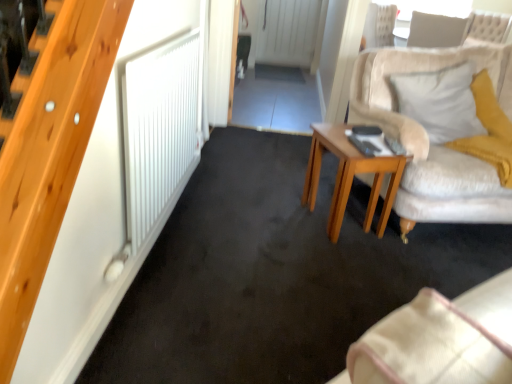
How much space does white fabric pillow at upper right, which is the 1th pillow in bottom-to-top order, occupy vertically?

white fabric pillow at upper right, which is the 1th pillow in bottom-to-top order, is 18.17 inches tall.

You are a GUI agent. You are given a task and a screenshot of the screen. Output one action in this format:
    pyautogui.click(x=<x>, y=<y>)
    Task: Click on the white fabric pillow at upper right, acting as the 2th pillow starting from the bottom
    The height and width of the screenshot is (384, 512).
    Given the screenshot: What is the action you would take?
    pyautogui.click(x=435, y=30)

Between white fabric pillow at upper right, the 2th pillow viewed from the top, and white fabric pillow at upper right, the first pillow when ordered from right to left, which one has larger size?

white fabric pillow at upper right, the first pillow when ordered from right to left.

Is white fabric pillow at upper right, placed as the 2th pillow when sorted from right to left, not close to white fabric pillow at upper right, which is the 1th pillow from back to front?

Yes, white fabric pillow at upper right, placed as the 2th pillow when sorted from right to left, and white fabric pillow at upper right, which is the 1th pillow from back to front, are quite far apart.

Can you confirm if white fabric pillow at upper right, which is the 1th pillow in bottom-to-top order, is positioned to the right of white fabric pillow at upper right, which is the 1th pillow from back to front?

Incorrect, white fabric pillow at upper right, which is the 1th pillow in bottom-to-top order, is not on the right side of white fabric pillow at upper right, which is the 1th pillow from back to front.

Which of these two, white fabric pillow at upper right, the 2th pillow viewed from the top, or white fabric pillow at upper right, marked as the 2th pillow in a left-to-right arrangement, is thinner?

white fabric pillow at upper right, the 2th pillow viewed from the top, is thinner.

Is white fabric pillow at upper right, acting as the 2th pillow starting from the bottom, far away from white fabric pillow at upper right, marked as the 2th pillow in a back-to-front arrangement?

Absolutely, white fabric pillow at upper right, acting as the 2th pillow starting from the bottom, is distant from white fabric pillow at upper right, marked as the 2th pillow in a back-to-front arrangement.

Where is `pillow below the white fabric pillow at upper right, acting as the 2th pillow starting from the bottom (from the image's perspective)`? The image size is (512, 384). pillow below the white fabric pillow at upper right, acting as the 2th pillow starting from the bottom (from the image's perspective) is located at coordinates (440, 102).

From the image's perspective, would you say white fabric pillow at upper right, the first pillow when ordered from right to left, is shown under white fabric pillow at upper right, the first pillow from the left?

No, from the image's perspective, white fabric pillow at upper right, the first pillow when ordered from right to left, is not below white fabric pillow at upper right, the first pillow from the left.

Considering the positions of points (439, 26) and (405, 103), is point (439, 26) farther from camera compared to point (405, 103)?

Yes, point (439, 26) is behind point (405, 103).

Considering the points (434, 45) and (388, 167), which point is in front, point (434, 45) or point (388, 167)?

The point (388, 167) is in front.

From the image's perspective, which one is positioned higher, white fabric pillow at upper right, marked as the 2th pillow in a left-to-right arrangement, or wooden side table at center?

From the image's view, white fabric pillow at upper right, marked as the 2th pillow in a left-to-right arrangement, is above.

Choose the correct answer: Is white fabric pillow at upper right, marked as the 1th pillow in a top-to-bottom arrangement, inside wooden side table at center or outside it?

white fabric pillow at upper right, marked as the 1th pillow in a top-to-bottom arrangement, is spatially situated outside wooden side table at center.

Can you tell me how much white fabric pillow at upper right, marked as the 2th pillow in a left-to-right arrangement, and wooden side table at center differ in facing direction?

125 degrees separate the facing orientations of white fabric pillow at upper right, marked as the 2th pillow in a left-to-right arrangement, and wooden side table at center.

Can white fabric pillow at upper right, the first pillow from the left, be found inside wooden side table at center?

Actually, white fabric pillow at upper right, the first pillow from the left, is outside wooden side table at center.

Is wooden side table at center in contact with white fabric pillow at upper right, which is the 1th pillow in bottom-to-top order?

No, wooden side table at center is not next to white fabric pillow at upper right, which is the 1th pillow in bottom-to-top order.

Measure the distance from wooden side table at center to white fabric pillow at upper right, marked as the 2th pillow in a back-to-front arrangement.

wooden side table at center and white fabric pillow at upper right, marked as the 2th pillow in a back-to-front arrangement, are 53.27 centimeters apart from each other.

From the image's perspective, who appears lower, wooden side table at center or white fabric pillow at upper right, marked as the 2th pillow in a back-to-front arrangement?

wooden side table at center, from the image's perspective.

Looking at this image, can you confirm if white fabric pillow at upper right, which is the 1th pillow in bottom-to-top order, is taller than wooden side table at center?

In fact, white fabric pillow at upper right, which is the 1th pillow in bottom-to-top order, may be shorter than wooden side table at center.

Looking at this image, is white fabric pillow at upper right, placed as the 2th pillow when sorted from right to left, bigger or smaller than wooden side table at center?

Considering their sizes, white fabric pillow at upper right, placed as the 2th pillow when sorted from right to left, takes up more space than wooden side table at center.

Is wooden side table at center at the back of white fabric pillow at upper right, the 2th pillow viewed from the top?

No, white fabric pillow at upper right, the 2th pillow viewed from the top, is not facing the opposite direction of wooden side table at center.

In the scene shown: From a real-world perspective, which is physically below, white fabric pillow at upper right, placed as the 2th pillow when sorted from right to left, or wooden side table at center?

wooden side table at center.

I want to click on the 2nd pillow directly above the wooden side table at center (from a real-world perspective), so click(x=435, y=30).

From a real-world perspective, between wooden side table at center and white fabric pillow at upper right, marked as the 2th pillow in a left-to-right arrangement, who is vertically lower?

wooden side table at center is physically lower.

Considering the relative positions of wooden side table at center and white fabric pillow at upper right, which is the 1th pillow from back to front, in the image provided, is wooden side table at center behind white fabric pillow at upper right, which is the 1th pillow from back to front,?

No, wooden side table at center is in front of white fabric pillow at upper right, which is the 1th pillow from back to front.

Identify the location of pillow in front of the white fabric pillow at upper right, marked as the 1th pillow in a top-to-bottom arrangement. The height and width of the screenshot is (384, 512). (440, 102).

The height and width of the screenshot is (384, 512). Identify the location of pillow behind the white fabric pillow at upper right, which is the 1th pillow in bottom-to-top order. (435, 30).

Looking at the image, which one is located further to wooden side table at center, white fabric pillow at upper right, marked as the 2th pillow in a left-to-right arrangement, or white fabric pillow at upper right, marked as the 2th pillow in a back-to-front arrangement?

Based on the image, white fabric pillow at upper right, marked as the 2th pillow in a left-to-right arrangement, appears to be further to wooden side table at center.

Estimate the real-world distances between objects in this image. Which object is closer to white fabric pillow at upper right, the first pillow when ordered from right to left, wooden side table at center or white fabric pillow at upper right, the 2th pillow viewed from the top?

white fabric pillow at upper right, the 2th pillow viewed from the top, is positioned closer to the anchor white fabric pillow at upper right, the first pillow when ordered from right to left.

Considering their positions, is white fabric pillow at upper right, the first pillow from the left, positioned closer to white fabric pillow at upper right, marked as the 2th pillow in a left-to-right arrangement, than wooden side table at center?

Based on the image, white fabric pillow at upper right, the first pillow from the left, appears to be nearer to white fabric pillow at upper right, marked as the 2th pillow in a left-to-right arrangement.

Considering their positions, is white fabric pillow at upper right, marked as the 1th pillow in a top-to-bottom arrangement, positioned further to white fabric pillow at upper right, marked as the 2th pillow in a back-to-front arrangement, than wooden side table at center?

Based on the image, white fabric pillow at upper right, marked as the 1th pillow in a top-to-bottom arrangement, appears to be further to white fabric pillow at upper right, marked as the 2th pillow in a back-to-front arrangement.

Estimate the real-world distances between objects in this image. Which object is further from white fabric pillow at upper right, marked as the 2th pillow in a back-to-front arrangement, wooden side table at center or white fabric pillow at upper right, the first pillow when ordered from right to left?

white fabric pillow at upper right, the first pillow when ordered from right to left, is further to white fabric pillow at upper right, marked as the 2th pillow in a back-to-front arrangement.

Based on their spatial positions, is white fabric pillow at upper right, which is the 1th pillow in bottom-to-top order, or white fabric pillow at upper right, marked as the 2th pillow in a left-to-right arrangement, closer to wooden side table at center?

white fabric pillow at upper right, which is the 1th pillow in bottom-to-top order, is positioned closer to the anchor wooden side table at center.

Locate an element on the screen. This screenshot has width=512, height=384. pillow between wooden side table at center and white fabric pillow at upper right, the first pillow when ordered from right to left, from front to back is located at coordinates (440, 102).